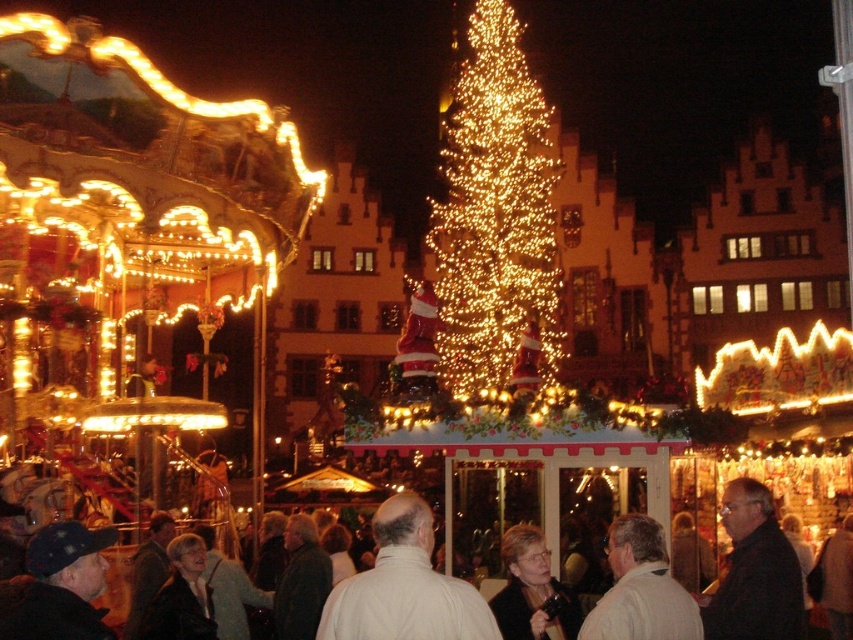
Question: Is dark clothing crowd at center above smooth beige coat at center?

Choices:
 (A) yes
 (B) no

Answer: (A)

Question: Does white matte jacket at center appear under dark gray sweater at center?

Choices:
 (A) yes
 (B) no

Answer: (B)

Question: Based on their relative distances, which object is farther from the smooth beige coat at center?

Choices:
 (A) white matte jacket at center
 (B) white matte jacket at lower center
 (C) dark clothing crowd at center

Answer: (A)

Question: Which point appears farthest from the camera in this image?

Choices:
 (A) (660, 556)
 (B) (97, 589)
 (C) (743, 582)

Answer: (C)

Question: Can you confirm if dark blue knit cap at lower left is bigger than white matte jacket at lower center?

Choices:
 (A) no
 (B) yes

Answer: (A)

Question: Which of the following is the closest to the observer?

Choices:
 (A) smooth beige coat at center
 (B) dark blue knit cap at lower left
 (C) dark gray sweater at center
 (D) white matte jacket at lower center

Answer: (B)